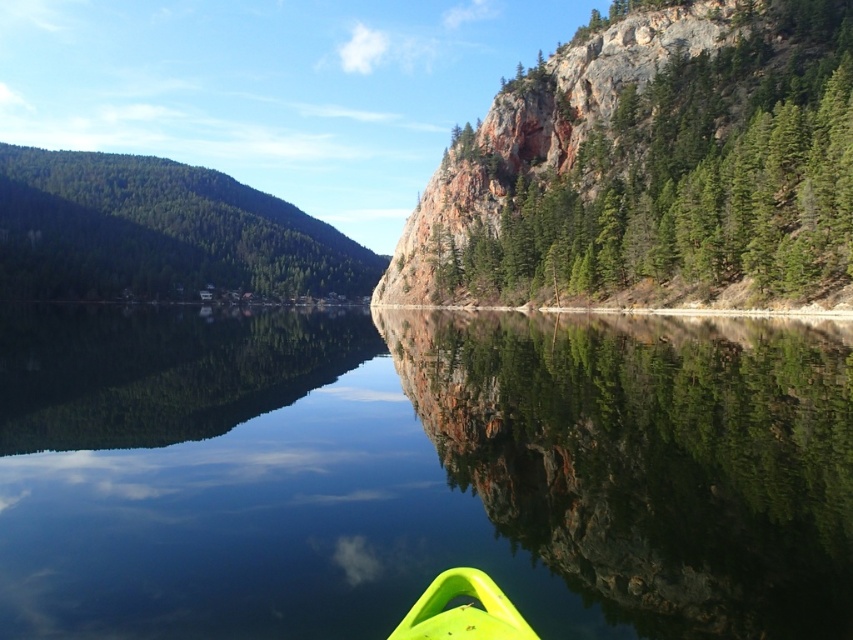
Locate an element on the screen. The width and height of the screenshot is (853, 640). green matte forest at left is located at coordinates (158, 230).

Is point (21, 164) behind point (502, 624)?

Yes, it is behind point (502, 624).

Where is `green matte forest at left`? This screenshot has width=853, height=640. green matte forest at left is located at coordinates (158, 230).

Is green textured rock at upper right positioned behind neon yellow plastic kayak at lower center?

Yes, green textured rock at upper right is further from the viewer.

Is green textured rock at upper right thinner than neon yellow plastic kayak at lower center?

No, green textured rock at upper right is not thinner than neon yellow plastic kayak at lower center.

Who is more forward, [660,250] or [410,616]?

Point [410,616]

Find the location of `green textured rock at upper right`. green textured rock at upper right is located at coordinates (689, 179).

Is point (218, 344) farther from camera compared to point (733, 273)?

Yes, it is behind point (733, 273).

Does point (500, 444) lie in front of point (653, 93)?

That is True.

At what (x,y) coordinates should I click in order to perform the action: click on transparent water at center. Please return your answer as a coordinate pair (x, y). This screenshot has width=853, height=640. Looking at the image, I should click on (419, 472).